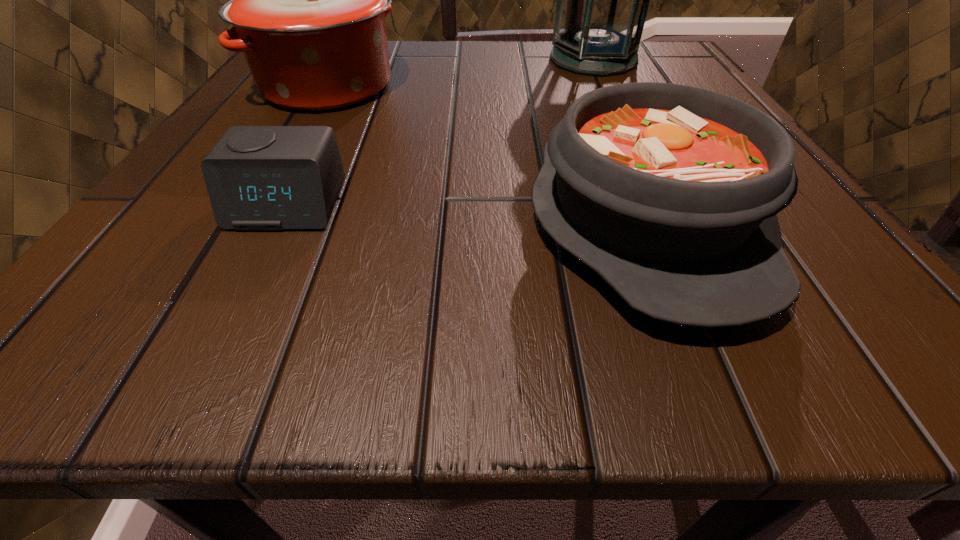
Identify the location of oil lamp positioned at the far edge. Image resolution: width=960 pixels, height=540 pixels. (602, 0).

Identify the location of casserole present at the far edge. (307, 0).

Identify the location of object situated at the near edge. The image size is (960, 540). (669, 192).

At what (x,y) coordinates should I click in order to perform the action: click on casserole located at the left edge. Please return your answer as a coordinate pair (x, y). Looking at the image, I should click on (x=307, y=0).

I want to click on alarm clock at the left edge, so click(258, 177).

At what (x,y) coordinates should I click in order to perform the action: click on oil lamp present at the right edge. Please return your answer as a coordinate pair (x, y). This screenshot has height=540, width=960. Looking at the image, I should click on (602, 0).

Find the location of `casserole that is at the right edge`. casserole that is at the right edge is located at coordinates (669, 192).

The width and height of the screenshot is (960, 540). In order to click on object situated at the far left corner in this screenshot , I will do `click(307, 0)`.

Identify the location of object situated at the far right corner. (602, 0).

Where is `object present at the near right corner`? This screenshot has height=540, width=960. object present at the near right corner is located at coordinates (669, 192).